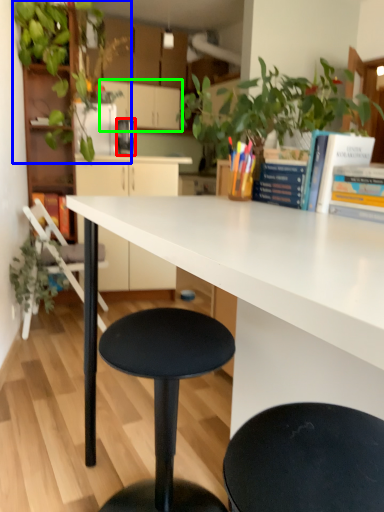
Question: Based on their relative distances, which object is farther from appliance (highlighted by a red box)? Choose from vegetation (highlighted by a blue box) and cabinetry (highlighted by a green box).

Choices:
 (A) vegetation
 (B) cabinetry

Answer: (B)